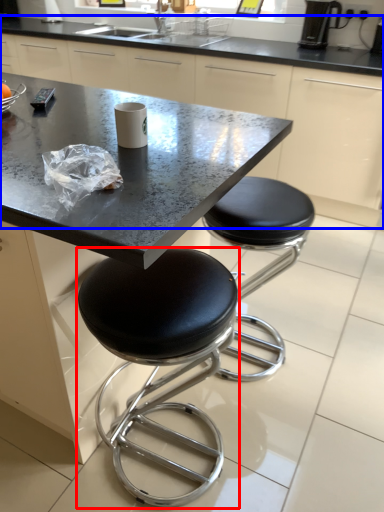
Question: Which of the following is the farthest to the observer, stool (highlighted by a red box) or counter (highlighted by a blue box)?

Choices:
 (A) stool
 (B) counter

Answer: (B)